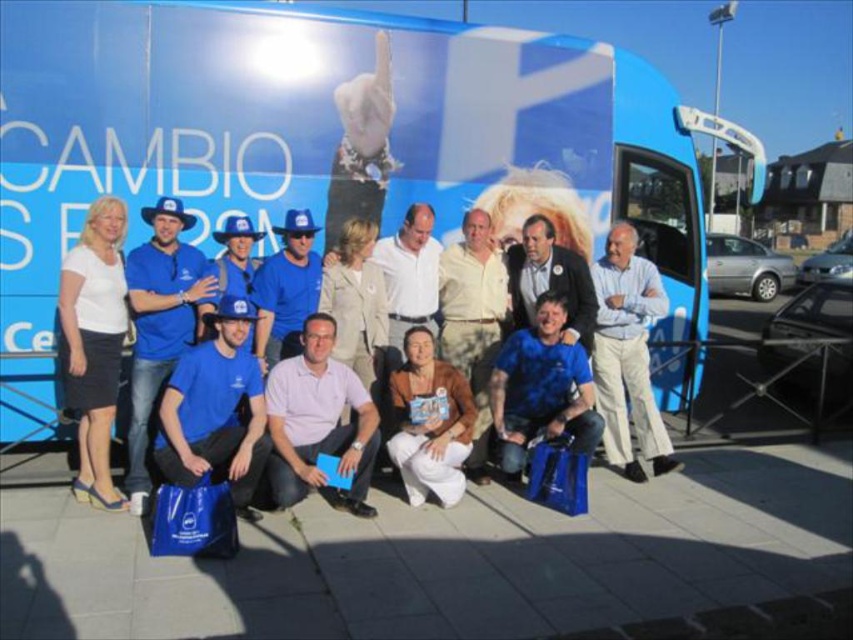
Question: Estimate the real-world distances between objects in this image. Which object is farther from the white fabric skirt at left?

Choices:
 (A) blue fabric bag at lower left
 (B) blue fabric bag at center
 (C) blue fabric shirt at center

Answer: (C)

Question: Is white fabric skirt at left thinner than white cotton shirt at center?

Choices:
 (A) yes
 (B) no

Answer: (A)

Question: Is blue fabric bag at center further to camera compared to brown fabric shirt at center?

Choices:
 (A) yes
 (B) no

Answer: (B)

Question: Can you confirm if blue fabric bag at center is positioned to the right of white fabric skirt at left?

Choices:
 (A) yes
 (B) no

Answer: (A)

Question: Which object is farther from the camera taking this photo?

Choices:
 (A) white cotton shirt at center
 (B) brown fabric shirt at center
 (C) blue fabric bag at center

Answer: (A)

Question: Which point is farther to the camera?

Choices:
 (A) blue matte bus at center
 (B) pink cotton shirt at center
 (C) blue fabric shirt at center
 (D) white cotton shirt at center

Answer: (A)